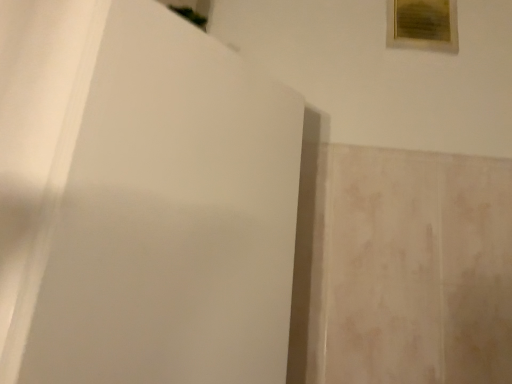
Question: Is white matte screen door at center wider or thinner than wooden frame at upper right?

Choices:
 (A) thin
 (B) wide

Answer: (B)

Question: Is white matte screen door at center bigger or smaller than wooden frame at upper right?

Choices:
 (A) small
 (B) big

Answer: (B)

Question: From their relative heights in the image, would you say white matte screen door at center is taller or shorter than wooden frame at upper right?

Choices:
 (A) tall
 (B) short

Answer: (A)

Question: From the image's perspective, relative to white matte screen door at center, is wooden frame at upper right above or below?

Choices:
 (A) below
 (B) above

Answer: (B)

Question: Is wooden frame at upper right in front of or behind white matte screen door at center in the image?

Choices:
 (A) front
 (B) behind

Answer: (B)

Question: Considering the positions of wooden frame at upper right and white matte screen door at center in the image, is wooden frame at upper right wider or thinner than white matte screen door at center?

Choices:
 (A) wide
 (B) thin

Answer: (B)

Question: From a real-world perspective, is wooden frame at upper right physically located above or below white matte screen door at center?

Choices:
 (A) below
 (B) above

Answer: (B)